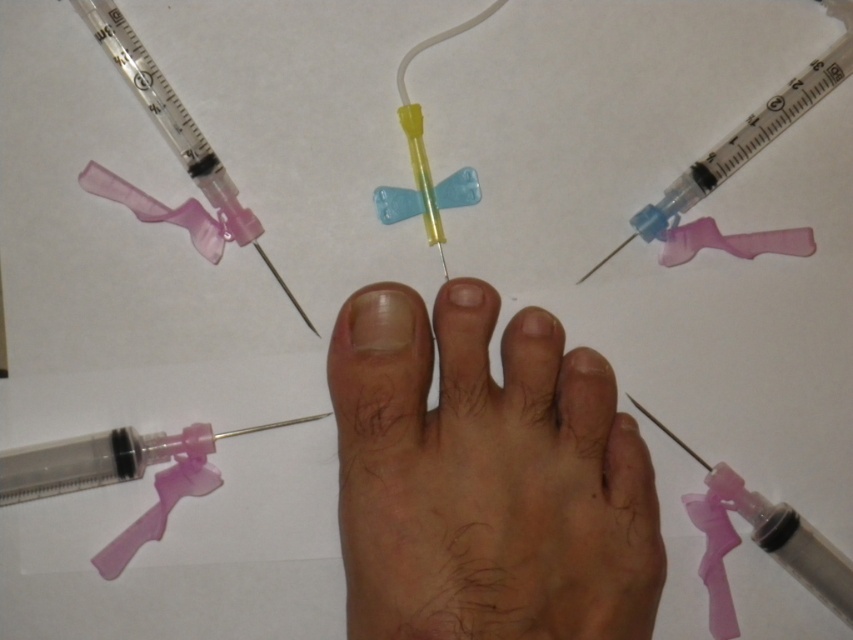
Question: Which point is closer to the camera taking this photo?

Choices:
 (A) (210, 150)
 (B) (390, 320)
 (C) (323, 412)

Answer: (B)

Question: Which point is farther to the camera?

Choices:
 (A) clear nail at center
 (B) pink translucent syringe at upper left
 (C) transparent plastic syringe at bottom left

Answer: (B)

Question: Considering the relative positions of transparent plastic syringe at bottom left and transparent plastic syringe at upper right in the image provided, where is transparent plastic syringe at bottom left located with respect to transparent plastic syringe at upper right?

Choices:
 (A) above
 (B) below

Answer: (B)

Question: Which point is farther from the camera taking this photo?

Choices:
 (A) (537, 310)
 (B) (445, 289)

Answer: (A)

Question: Does transparent plastic syringe at bottom left appear over smooth skin toe at center?

Choices:
 (A) yes
 (B) no

Answer: (B)

Question: Is transparent plastic syringe at bottom left positioned before smooth skin toe at center?

Choices:
 (A) no
 (B) yes

Answer: (A)